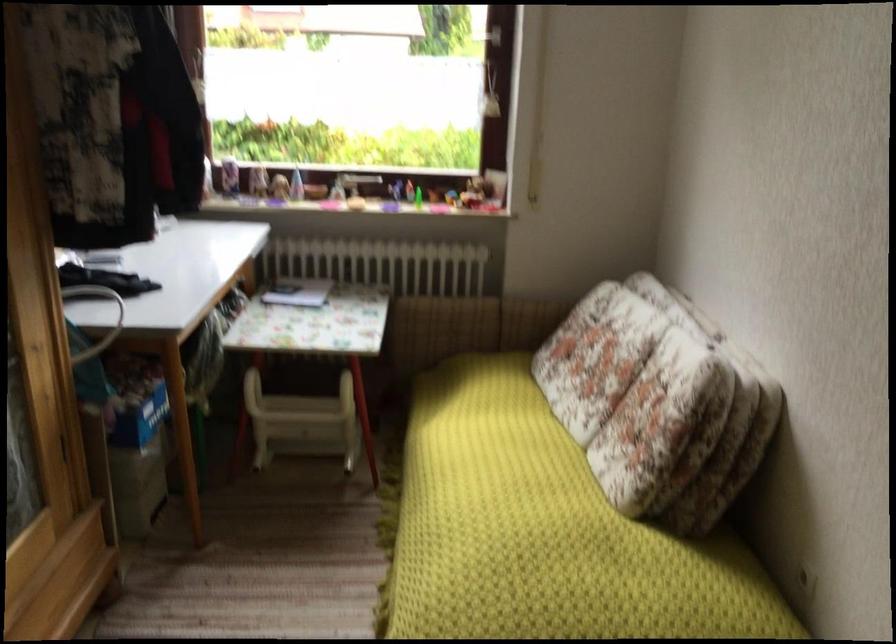
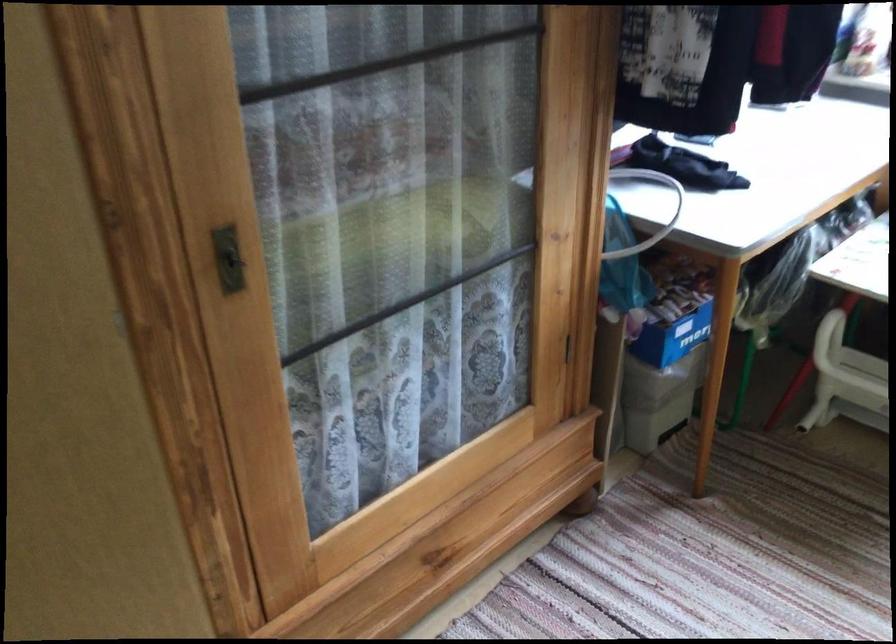
Based on the continuous images, in which direction is the camera rotating?

The camera's rotation is toward left-down.